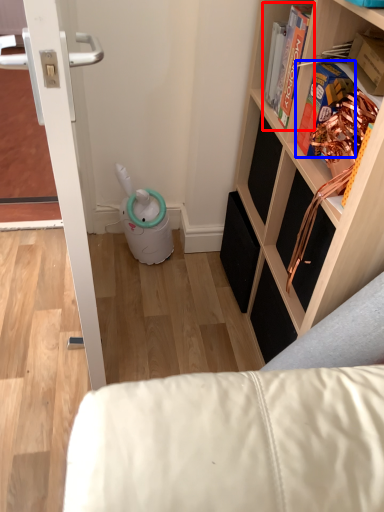
Question: Which object appears farthest to the camera in this image, book (highlighted by a red box) or book (highlighted by a blue box)?

Choices:
 (A) book
 (B) book

Answer: (A)